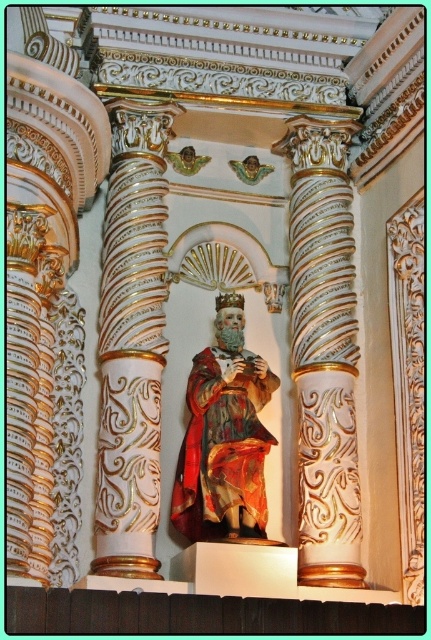
Can you confirm if white glossy column at center is shorter than white marble column at center?

Yes, white glossy column at center is shorter than white marble column at center.

Who is more distant from viewer, (127, 141) or (339, 532)?

Point (127, 141)

The height and width of the screenshot is (640, 431). What are the coordinates of `white glossy column at center` in the screenshot? It's located at (131, 340).

Is the position of white glossy column at center more distant than that of red velvet robe at center?

No, white glossy column at center is closer to the viewer.

The height and width of the screenshot is (640, 431). Describe the element at coordinates (131, 340) in the screenshot. I see `white glossy column at center` at that location.

The height and width of the screenshot is (640, 431). In order to click on white glossy column at center in this screenshot , I will do `click(131, 340)`.

The height and width of the screenshot is (640, 431). Describe the element at coordinates (324, 349) in the screenshot. I see `white marble column at center` at that location.

Can you confirm if white marble column at center is bigger than red velvet robe at center?

Yes, white marble column at center is bigger than red velvet robe at center.

You are a GUI agent. You are given a task and a screenshot of the screen. Output one action in this format:
    pyautogui.click(x=<x>, y=<y>)
    Task: Click on the white marble column at center
    This screenshot has width=431, height=640.
    Given the screenshot: What is the action you would take?
    pyautogui.click(x=324, y=349)